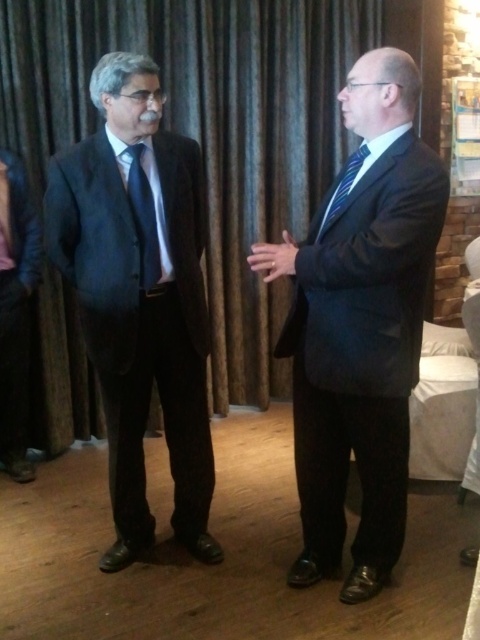
Where is `brown textured curtain at upper center`? This screenshot has height=640, width=480. brown textured curtain at upper center is located at coordinates (205, 131).

Is point (279, 296) behind point (145, 246)?

Yes, point (279, 296) is behind point (145, 246).

Where is `brown textured curtain at upper center`? This screenshot has height=640, width=480. brown textured curtain at upper center is located at coordinates (x=205, y=131).

Measure the distance between dark blue suit at left and camera.

dark blue suit at left is 6.03 feet away from camera.

Is dark blue suit at left bigger than matte black tie at center?

Yes.

Locate an element on the screen. The width and height of the screenshot is (480, 640). dark blue suit at left is located at coordinates (140, 296).

The width and height of the screenshot is (480, 640). I want to click on dark blue suit at left, so click(140, 296).

Between point (395, 346) and point (336, 211), which one is positioned behind?

Positioned behind is point (336, 211).

Can you confirm if matte black suit at center is wider than blue striped tie at right?

Correct, the width of matte black suit at center exceeds that of blue striped tie at right.

This screenshot has height=640, width=480. Identify the location of matte black suit at center. (360, 324).